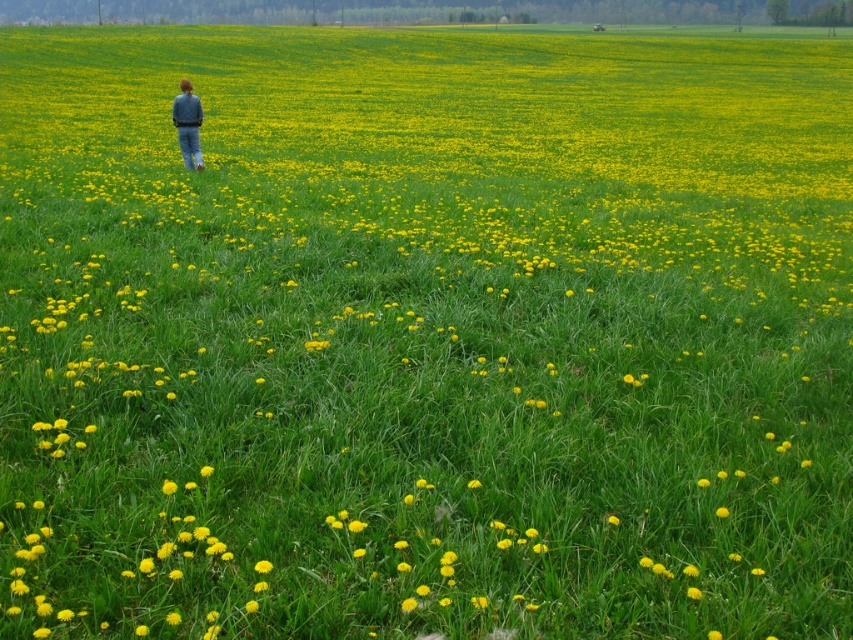
Is denim jacket at upper left taller than yellow matte flower at center?

Indeed, denim jacket at upper left has a greater height compared to yellow matte flower at center.

Is point (186, 106) farther from viewer compared to point (260, 563)?

Yes.

This screenshot has width=853, height=640. I want to click on denim jacket at upper left, so click(189, 124).

Locate an element on the screen. The width and height of the screenshot is (853, 640). denim jacket at upper left is located at coordinates (189, 124).